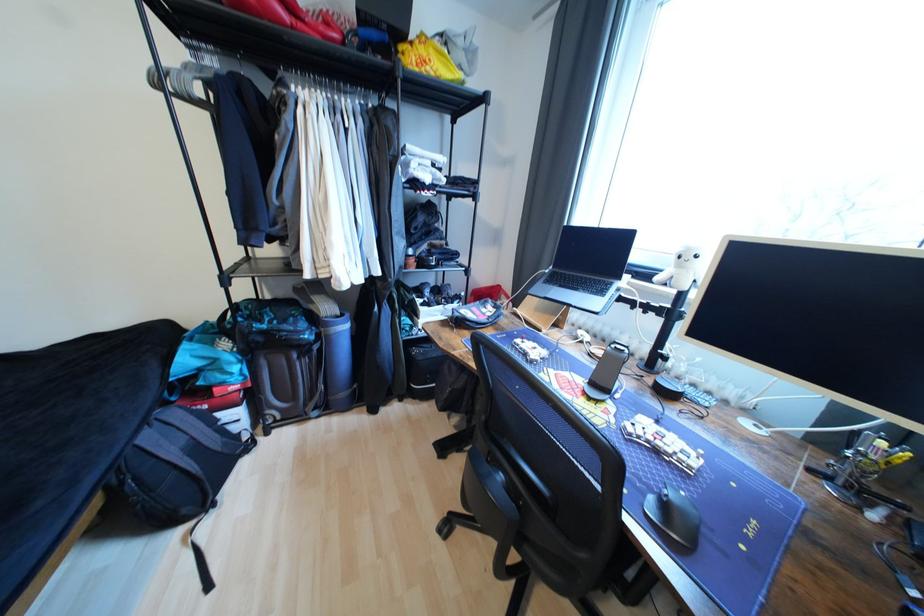
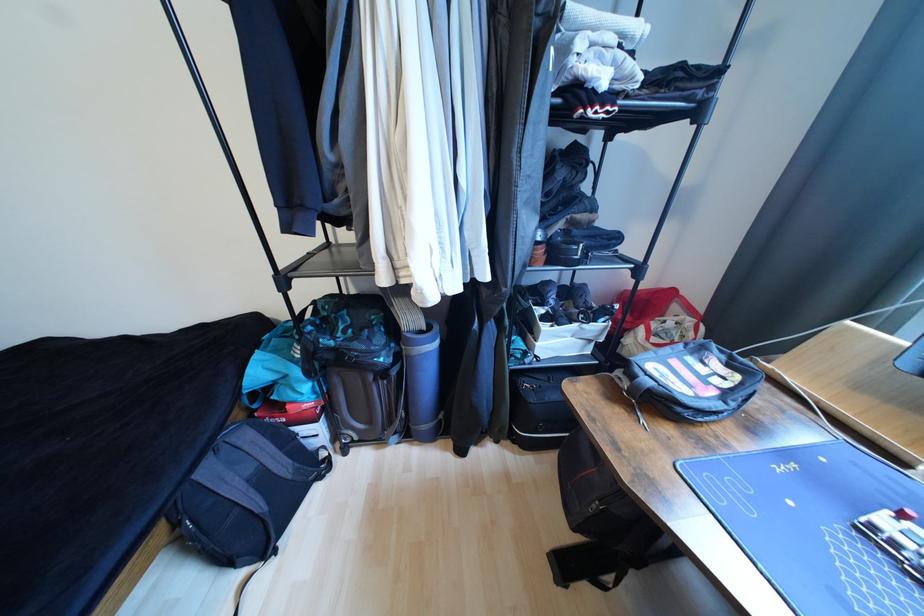
Find the pixel in the second image that matches point 155,439 in the first image.

(215, 472)